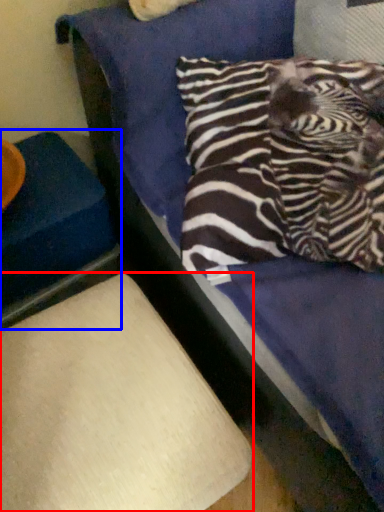
Question: Which of the following is the farthest to the observer, furniture (highlighted by a red box) or furniture (highlighted by a blue box)?

Choices:
 (A) furniture
 (B) furniture

Answer: (B)